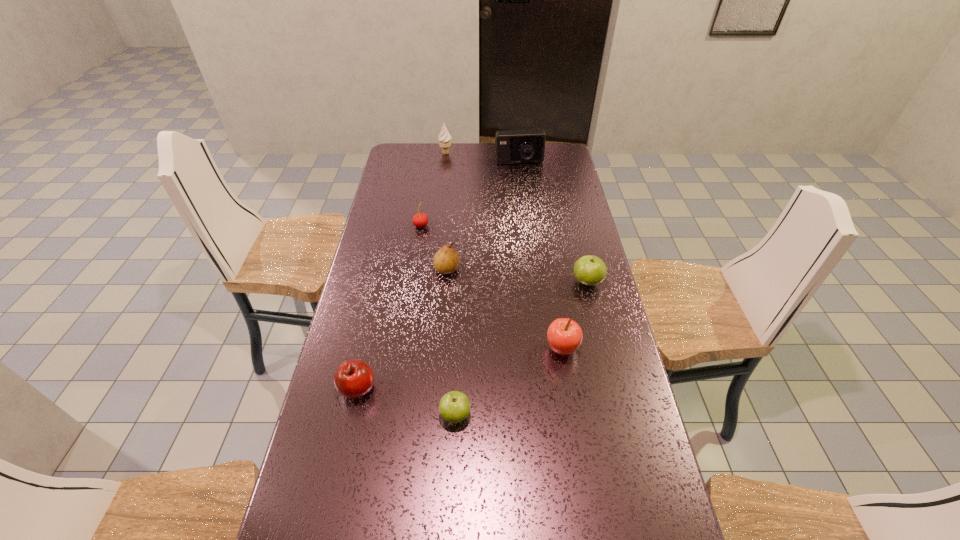
The image size is (960, 540). Find the location of `free space at the right edge of the desktop`. free space at the right edge of the desktop is located at coordinates 564,215.

Locate an element on the screen. Image resolution: width=960 pixels, height=540 pixels. free location at the far left corner of the desktop is located at coordinates (405, 169).

At what (x,y) coordinates should I click in order to perform the action: click on vacant space at the far right corner of the desktop. Please return your answer as a coordinate pair (x, y). The image size is (960, 540). Looking at the image, I should click on (558, 150).

At what (x,y) coordinates should I click in order to perform the action: click on free space between the left pink apple and the second apple from left to right. Please return your answer as a coordinate pair (x, y). This screenshot has height=540, width=960. Looking at the image, I should click on (406, 402).

Find the location of a particular element. The height and width of the screenshot is (540, 960). free space between the leftmost object and the brown pear is located at coordinates (402, 329).

What are the coordinates of `vacant space that's between the icecream and the third nearest apple` in the screenshot? It's located at (504, 251).

Where is `free space between the nearer pink apple and the farthest object`? Image resolution: width=960 pixels, height=540 pixels. free space between the nearer pink apple and the farthest object is located at coordinates (401, 271).

You are a GUI agent. You are given a task and a screenshot of the screen. Output one action in this format:
    pyautogui.click(x=<x>, y=<y>)
    Task: Click on the empty location between the blue camera and the rightmost object
    
    Given the screenshot: What is the action you would take?
    pyautogui.click(x=553, y=222)

At what (x,y) coordinates should I click in order to perform the action: click on free space between the pear and the farthest object. Please return your answer as a coordinate pair (x, y). Image resolution: width=960 pixels, height=540 pixels. Looking at the image, I should click on (446, 211).

The height and width of the screenshot is (540, 960). Identify the location of vacant space that's between the brown pear and the blue camera. pos(483,217).